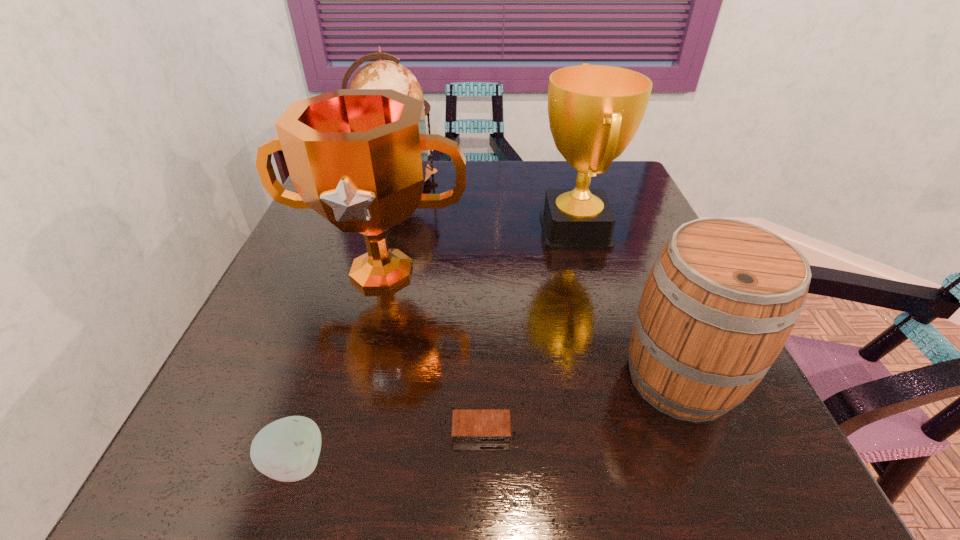
Where is `blank space at the far right corner of the desktop`? blank space at the far right corner of the desktop is located at coordinates point(593,185).

At what (x,y) coordinates should I click in order to perform the action: click on vacant area that lies between the shortest object and the right award. Please return your answer as a coordinate pair (x, y). Looking at the image, I should click on (528, 330).

The width and height of the screenshot is (960, 540). I want to click on free point between the second shortest object and the right award, so click(435, 347).

Identify the location of vacant region between the fifth tallest object and the globe. This screenshot has height=540, width=960. (347, 322).

Where is `vacant space in between the alarm clock and the fourth tallest object`? vacant space in between the alarm clock and the fourth tallest object is located at coordinates (581, 404).

Image resolution: width=960 pixels, height=540 pixels. Find the location of `free space between the fourth tallest object and the globe`. free space between the fourth tallest object and the globe is located at coordinates (540, 279).

Locate an element on the screen. free space between the shortest object and the third shortest object is located at coordinates (581, 404).

Where is `free space between the globe and the cider`? The image size is (960, 540). free space between the globe and the cider is located at coordinates (540, 279).

Image resolution: width=960 pixels, height=540 pixels. Find the location of `free area in between the left award and the right award`. free area in between the left award and the right award is located at coordinates (478, 252).

You are a GUI agent. You are given a task and a screenshot of the screen. Output one action in this format:
    pyautogui.click(x=<x>, y=<y>)
    Task: Click on the blank region between the fifth tallest object and the shortest object
    This screenshot has height=540, width=960.
    Given the screenshot: What is the action you would take?
    pyautogui.click(x=389, y=447)